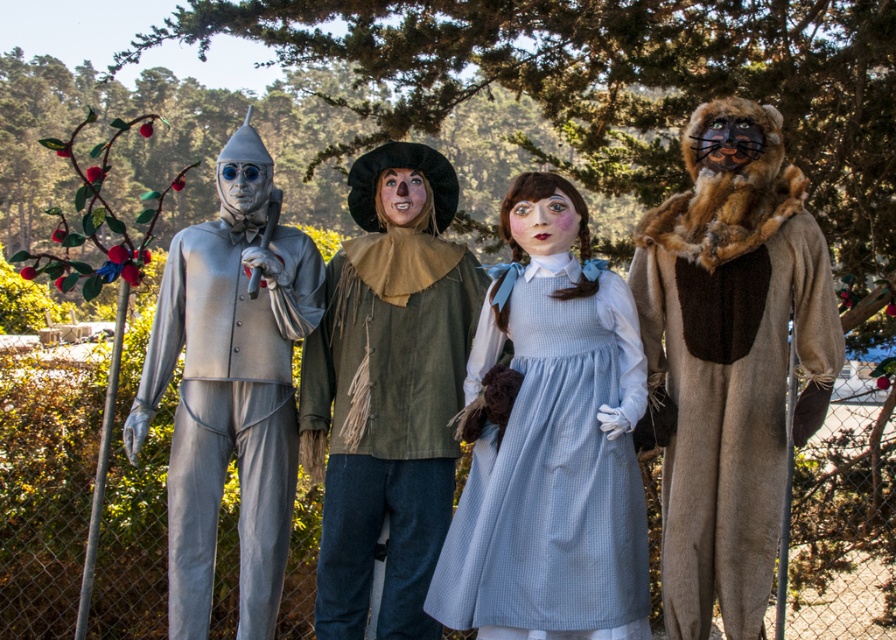
Between fuzzy brown costume at right and light blue gingham dress at center, which one appears on the left side from the viewer's perspective?

light blue gingham dress at center is more to the left.

Between fuzzy brown costume at right and light blue gingham dress at center, which one is positioned lower?

light blue gingham dress at center is below.

You are a GUI agent. You are given a task and a screenshot of the screen. Output one action in this format:
    pyautogui.click(x=<x>, y=<y>)
    Task: Click on the fuzzy brown costume at right
    The image size is (896, 640).
    Given the screenshot: What is the action you would take?
    [x=731, y=356]

Locate an element on the screen. fuzzy brown costume at right is located at coordinates (x=731, y=356).

Does fuzzy brown costume at right appear on the right side of green fabric costume at center?

Yes, fuzzy brown costume at right is to the right of green fabric costume at center.

Does point (707, 348) come behind point (399, 632)?

No, (707, 348) is in front of (399, 632).

At what (x,y) coordinates should I click in order to perform the action: click on fuzzy brown costume at right. Please return your answer as a coordinate pair (x, y). Looking at the image, I should click on (731, 356).

Who is more forward, (524, 396) or (231, 141)?

Point (524, 396) is in front.

From the picture: Does light blue gingham dress at center appear over metallic silver suit at left?

No, light blue gingham dress at center is not above metallic silver suit at left.

Is point (623, 496) positioned behind point (209, 288)?

No, it is not.

This screenshot has height=640, width=896. I want to click on light blue gingham dress at center, so click(552, 468).